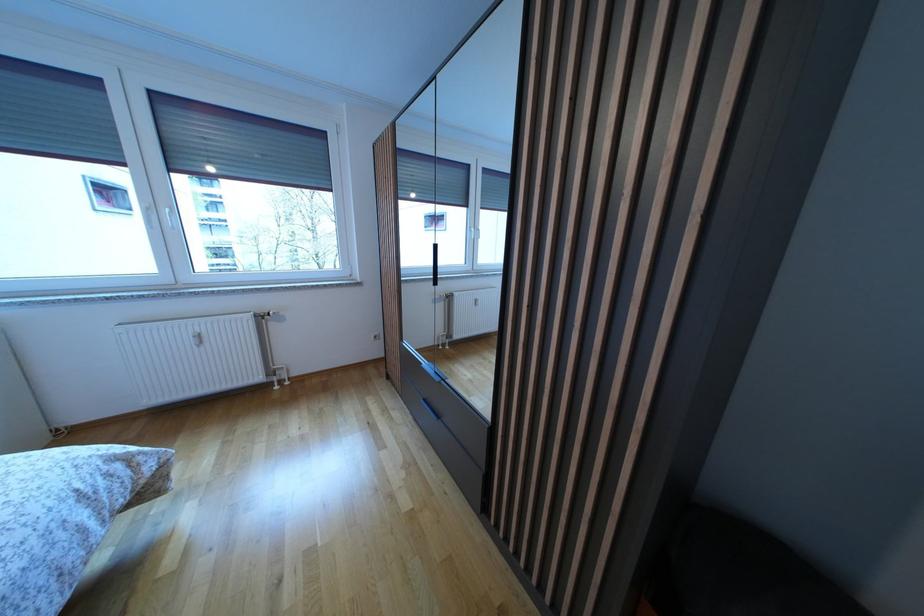
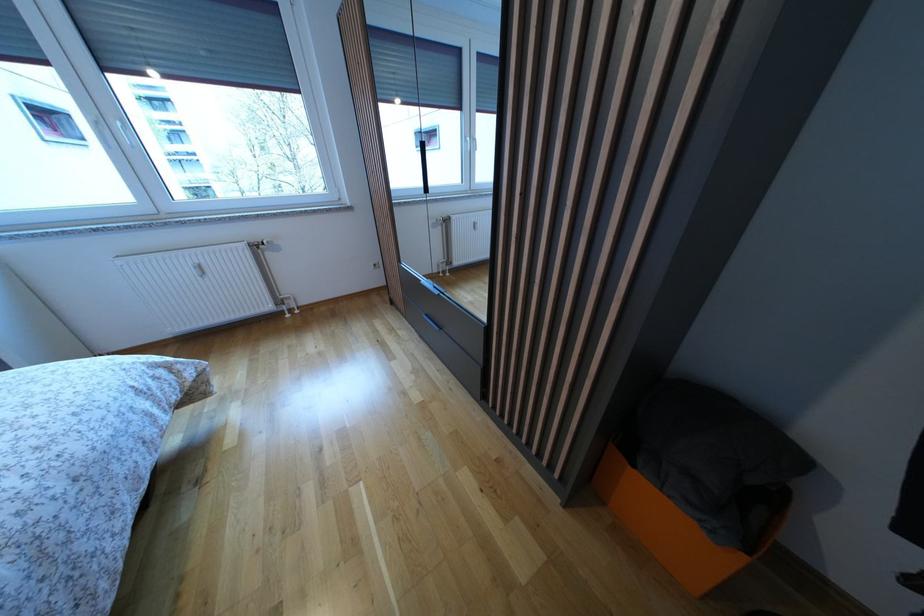
In the second image, find the point that corresponds to the point at 432,406 in the first image.

(433, 321)